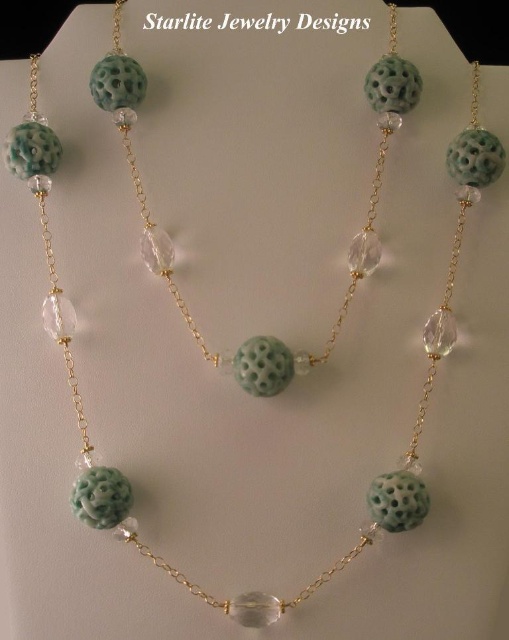
Does matte green stone at center appear under green carved stone at center?

No.

Can you confirm if matte green stone at center is taller than green carved stone at center?

Indeed, matte green stone at center has a greater height compared to green carved stone at center.

Which is in front, point (381, 72) or point (416, 502)?

Point (416, 502) is more forward.

Where is `matte green stone at center`? The height and width of the screenshot is (640, 509). matte green stone at center is located at coordinates (351, 243).